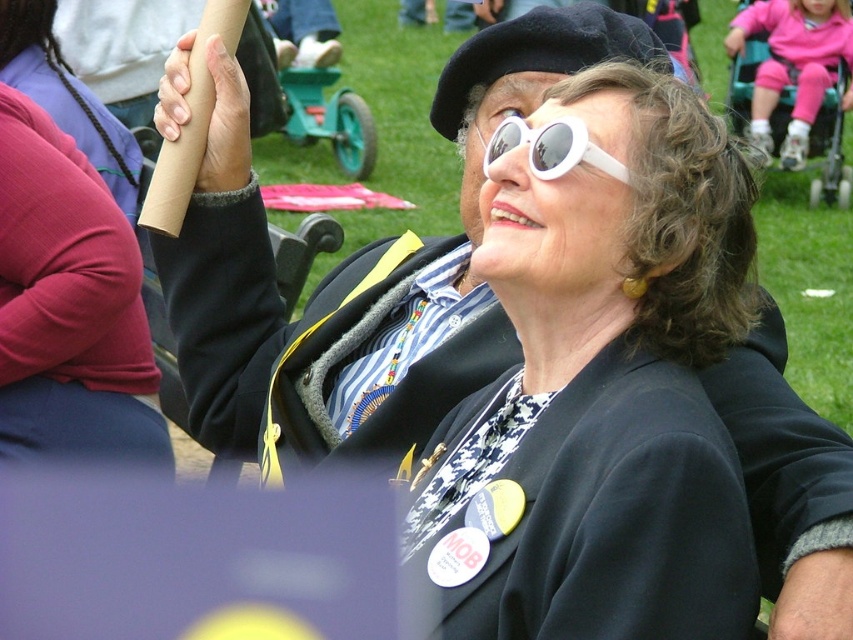
You are standing in the outdoor gathering scene. You see the white matte sunglasses at upper center. Where exactly are they located in terms of coordinates?

The white matte sunglasses at upper center are located at coordinates point (599, 381).

You are standing at the point marked as point (677, 330) in the image. You want to walk towards the woman in the wheelchair wearing a black jacket with badges. How far will you have to walk to reach her?

The distance of point (677, 330) from viewer is 14.86 meters, so you will have to walk 14.86 meters to reach the woman in the wheelchair wearing a black jacket with badges.

You are a photographer trying to capture a clear shot of both the white matte sunglasses at upper center and the white plastic sunglasses at upper center in the image. Since they are both at the same position, which one should you focus on first to ensure both are in focus?

The white matte sunglasses at upper center is larger in size than the white plastic sunglasses at upper center. To ensure both are in focus, you should focus on the larger one first since it requires more detailed capture.